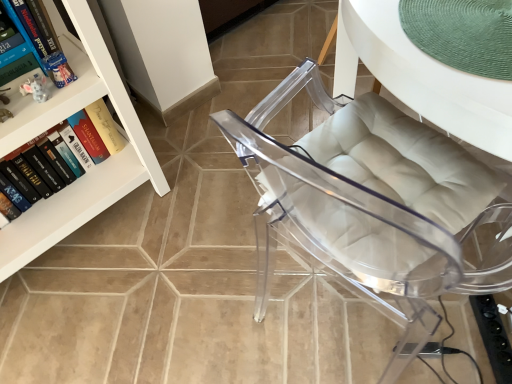
Question: Based on their positions, is white glossy bookcase at upper left located to the left or right of transparent acrylic chair at center?

Choices:
 (A) left
 (B) right

Answer: (A)

Question: Relative to transparent acrylic chair at center, is white glossy bookcase at upper left in front or behind?

Choices:
 (A) behind
 (B) front

Answer: (A)

Question: Estimate the real-world distances between objects in this image. Which object is farther from the hardcover book at left, acting as the first book starting from the bottom?

Choices:
 (A) white glossy bookcase at upper left
 (B) transparent acrylic chair at center
 (C) green woven placemat at upper right
 (D) hardcover book at upper left, which appears as the first book when viewed from the top

Answer: (C)

Question: Estimate the real-world distances between objects in this image. Which object is closer to the hardcover book at left, which is counted as the 2th book, starting from the top?

Choices:
 (A) green woven placemat at upper right
 (B) hardcover book at upper left, arranged as the 2th book when ordered from the bottom
 (C) transparent acrylic chair at center
 (D) white glossy bookcase at upper left

Answer: (D)